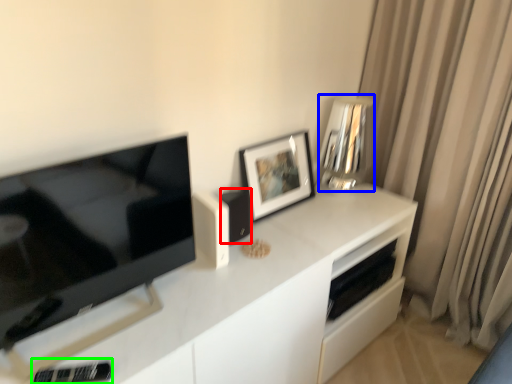
Question: Which object is positioned farthest from appliance (highlighted by a red box)? Select from appliance (highlighted by a blue box) and appliance (highlighted by a green box).

Choices:
 (A) appliance
 (B) appliance

Answer: (B)